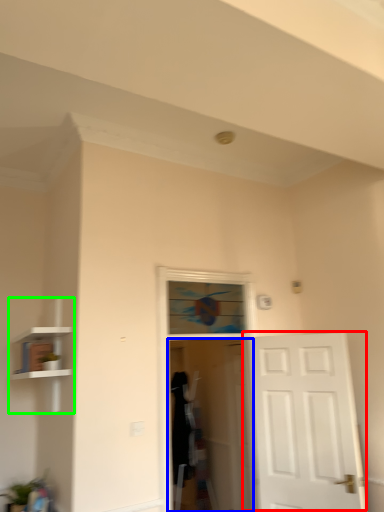
Question: Estimate the real-world distances between objects in this image. Which object is farther from door (highlighted by a red box), screen door (highlighted by a blue box) or bookshelf (highlighted by a green box)?

Choices:
 (A) screen door
 (B) bookshelf

Answer: (B)